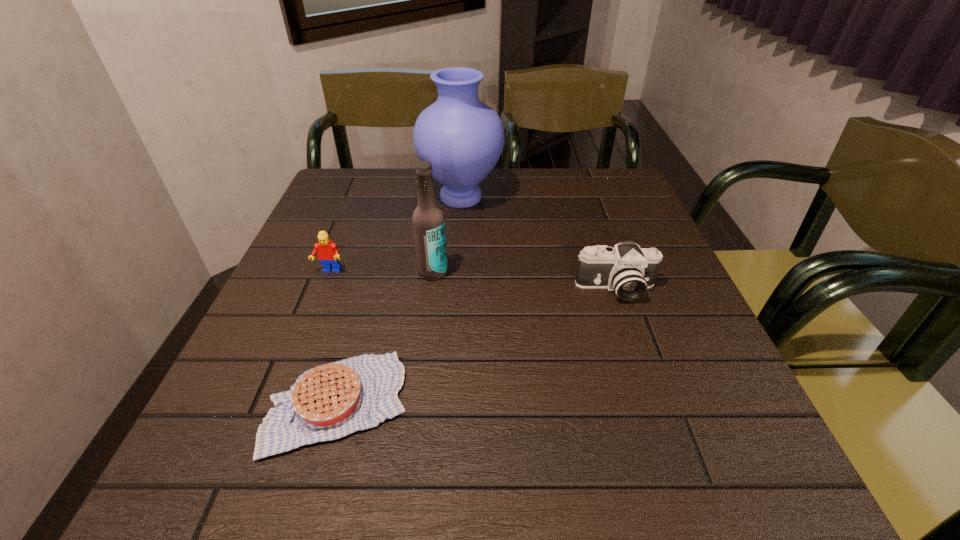
The height and width of the screenshot is (540, 960). I want to click on vacant space at the left edge, so click(x=305, y=263).

You are a GUI agent. You are given a task and a screenshot of the screen. Output one action in this format:
    pyautogui.click(x=<x>, y=<y>)
    Task: Click on the free space at the right edge of the desktop
    The width and height of the screenshot is (960, 540).
    Given the screenshot: What is the action you would take?
    point(749,417)

Identify the location of vacant point at the far left corner. The width and height of the screenshot is (960, 540). (368, 203).

Identify the location of free spot between the farthest object and the Lego. The image size is (960, 540). (396, 234).

In order to click on free spot between the Lego and the camera in this screenshot , I will do `click(472, 280)`.

Where is `empty space between the vase and the rightmost object`? empty space between the vase and the rightmost object is located at coordinates (538, 243).

You are a GUI agent. You are given a task and a screenshot of the screen. Output one action in this format:
    pyautogui.click(x=<x>, y=<y>)
    Task: Click on the vacant space that is in between the Lego and the fourth shortest object
    The image size is (960, 540).
    Given the screenshot: What is the action you would take?
    tap(381, 272)

Identify the location of empty space between the nearest object and the farthest object. (399, 300).

The image size is (960, 540). I want to click on vacant area that lies between the farthest object and the rightmost object, so [x=538, y=243].

Image resolution: width=960 pixels, height=540 pixels. In order to click on free area in between the beer bottle and the vase in this screenshot , I will do `click(447, 234)`.